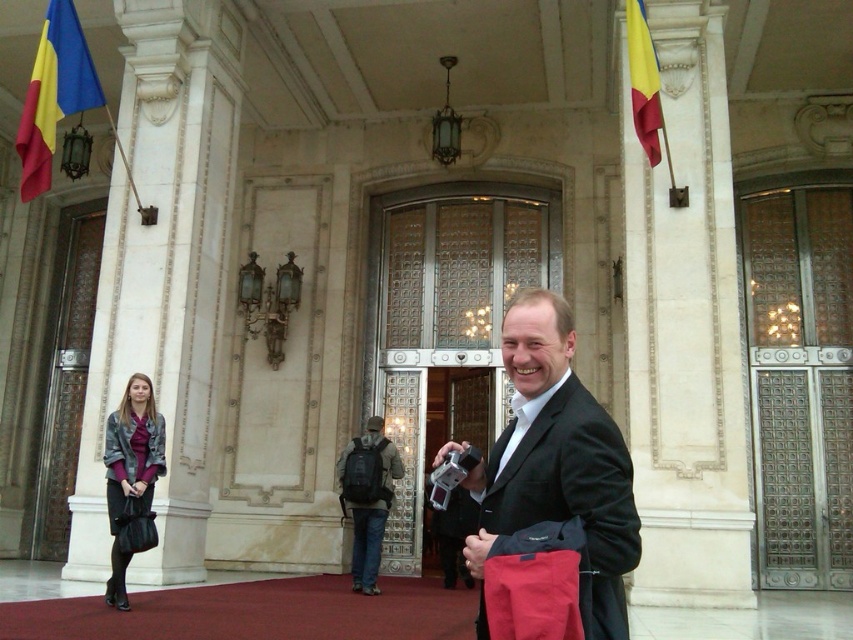
Between point (30, 168) and point (648, 88), which one is positioned behind?

Positioned behind is point (30, 168).

Which is behind, point (39, 160) or point (641, 77)?

The point (39, 160) is more distant.

Image resolution: width=853 pixels, height=640 pixels. Identify the location of blue fabric flag at upper left. (53, 93).

Is polyester flag at upper right to the right of matte black backpack at center from the viewer's perspective?

Correct, you'll find polyester flag at upper right to the right of matte black backpack at center.

Is polyester flag at upper right to the left of matte black backpack at center from the viewer's perspective?

No, polyester flag at upper right is not to the left of matte black backpack at center.

Identify the location of polyester flag at upper right. (643, 81).

The width and height of the screenshot is (853, 640). Find the location of `polyester flag at upper right`. polyester flag at upper right is located at coordinates (643, 81).

Is black matte suit at center bigger than blue fabric flag at upper left?

Actually, black matte suit at center might be smaller than blue fabric flag at upper left.

Can you confirm if black matte suit at center is taller than blue fabric flag at upper left?

No.

I want to click on black matte suit at center, so click(556, 460).